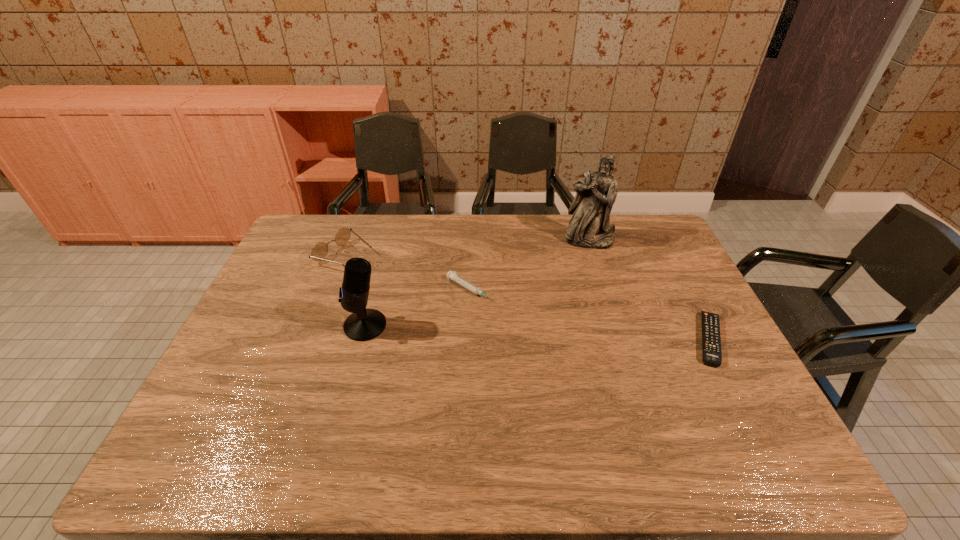
Locate an element on the screen. The image size is (960, 540). free region located 0.290m on the front-facing side of the figurine is located at coordinates [x=581, y=308].

Find the location of a particular element. spectacles that is positioned at the far edge is located at coordinates (320, 250).

The height and width of the screenshot is (540, 960). Identify the location of figurine positioned at the far edge. (589, 227).

The width and height of the screenshot is (960, 540). Find the location of `object located in the left edge section of the desktop`. object located in the left edge section of the desktop is located at coordinates (320, 250).

Where is `object at the right edge`? This screenshot has width=960, height=540. object at the right edge is located at coordinates (711, 340).

You are a GUI agent. You are given a task and a screenshot of the screen. Output one action in this format:
    pyautogui.click(x=<x>, y=<y>)
    Task: Click on the object located at the far left corner
    
    Given the screenshot: What is the action you would take?
    pyautogui.click(x=320, y=250)

Where is `vacant space at the far edge of the desktop`? The image size is (960, 540). vacant space at the far edge of the desktop is located at coordinates (515, 225).

Find the location of a particular element. free region at the near edge is located at coordinates (495, 398).

The width and height of the screenshot is (960, 540). Find the location of `free space at the left edge of the desktop`. free space at the left edge of the desktop is located at coordinates (279, 369).

The image size is (960, 540). What are the coordinates of `vacant space at the right edge of the desktop` in the screenshot? It's located at (651, 264).